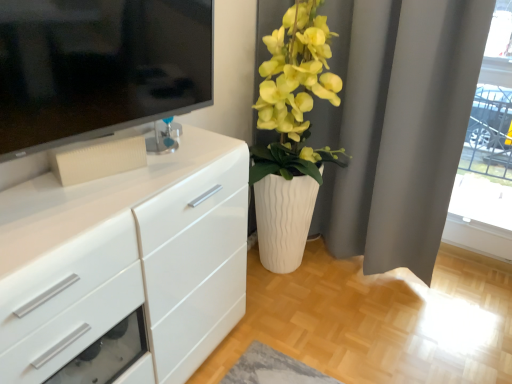
Question: Which is correct: transparent glass door at upper right is inside white matte curtain at upper right, or outside of it?

Choices:
 (A) outside
 (B) inside

Answer: (A)

Question: Looking at their shapes, would you say transparent glass door at upper right is wider or thinner than white matte curtain at upper right?

Choices:
 (A) wide
 (B) thin

Answer: (B)

Question: Which object is positioned farthest from the matte white vase at center right?

Choices:
 (A) transparent glass door at upper right
 (B) white matte curtain at upper right
 (C) white glossy chest of drawers at left

Answer: (A)

Question: Based on their relative distances, which object is nearer to the transparent glass door at upper right?

Choices:
 (A) white glossy chest of drawers at left
 (B) white matte curtain at upper right
 (C) matte white vase at center right

Answer: (B)